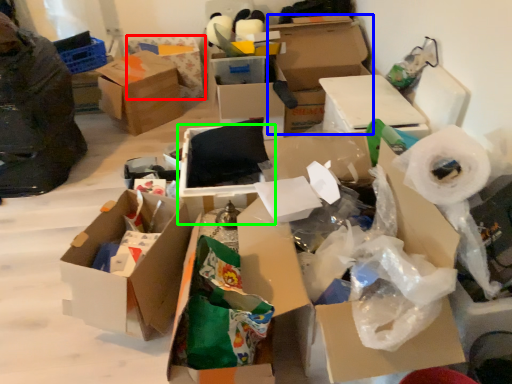
Question: Considering the real-world distances, which object is farthest from box (highlighted by a red box)? box (highlighted by a blue box) or box (highlighted by a green box)?

Choices:
 (A) box
 (B) box

Answer: (B)